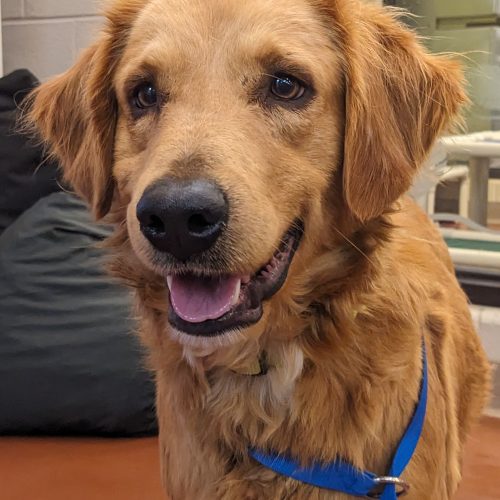
Where is `gray fabric`? gray fabric is located at coordinates (84, 332).